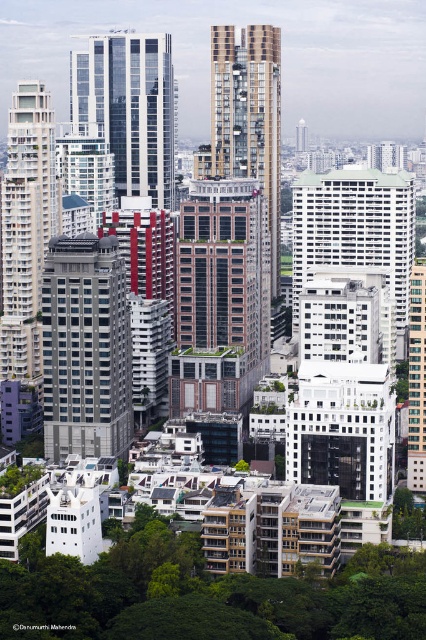
You are standing at the base of the white glossy building at left and want to walk to the white glossy building at center. In which direction should you move relative to your current position?

You should move to the right relative to your current position because the white glossy building at center is to the right of the white glossy building at left.

You are an urban planner assessing building widths for a new project. You observe the matte gray building at center and the white glossy building at left in the scene. Which building has a greater width?

The matte gray building at center has a greater width than the white glossy building at left.

Based on the photo, you are standing at the entrance of the white glossy building at left and want to walk to the matte gray building at center. Which direction should you face to see both buildings at the same time?

You should face to the right so that both the white glossy building at left and the matte gray building at center come into your field of view simultaneously.